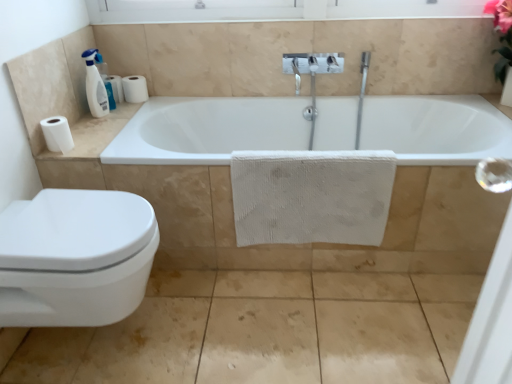
Find the location of a particular element. free location above white textured towel at center (from a real-world perspective) is located at coordinates (320, 153).